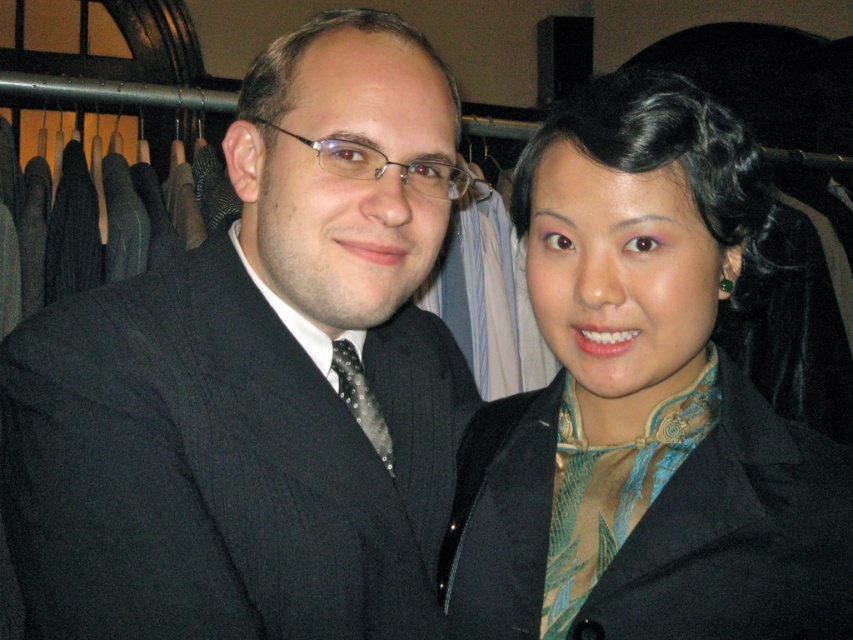
Who is positioned more to the right, matte black suit at center or matte black coat at right?

matte black coat at right

Is matte black suit at center below matte black coat at right?

Correct, matte black suit at center is located below matte black coat at right.

Is point (346, 333) more distant than point (584, 97)?

That is True.

I want to click on matte black suit at center, so click(257, 378).

What do you see at coordinates (257, 378) in the screenshot?
I see `matte black suit at center` at bounding box center [257, 378].

Image resolution: width=853 pixels, height=640 pixels. Describe the element at coordinates (257, 378) in the screenshot. I see `matte black suit at center` at that location.

Where is `matte black suit at center`? matte black suit at center is located at coordinates click(257, 378).

Which of these two, matte black coat at right or black dotted tie at center, stands taller?

Standing taller between the two is matte black coat at right.

Based on the photo, does matte black coat at right appear on the right side of black dotted tie at center?

Yes, matte black coat at right is to the right of black dotted tie at center.

Who is more distant from viewer, (572, 241) or (386, 458)?

The point (386, 458) is more distant.

Identify the location of matte black coat at right. The width and height of the screenshot is (853, 640). (643, 403).